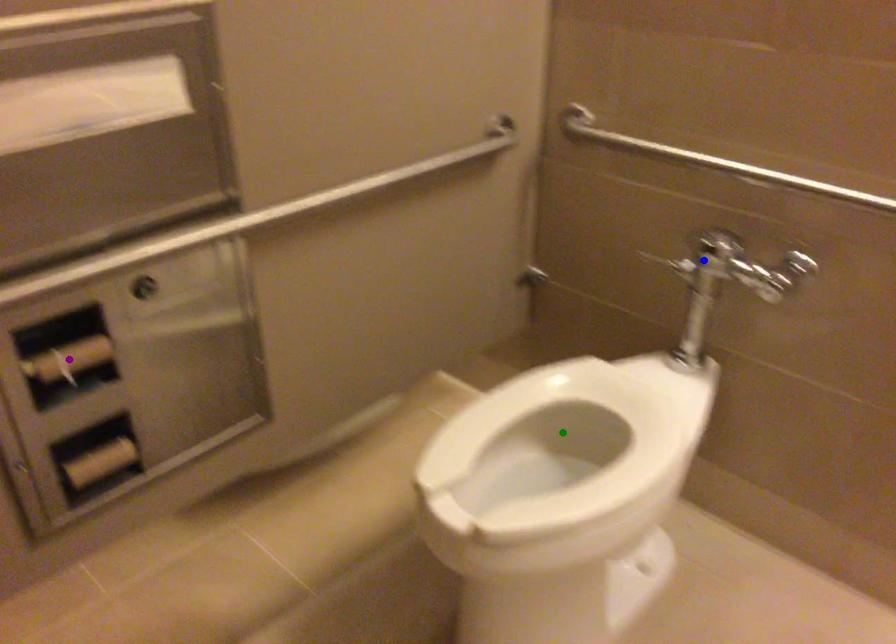
Order these from farthest to nearest:
- blue point
- purple point
- green point

blue point → green point → purple point